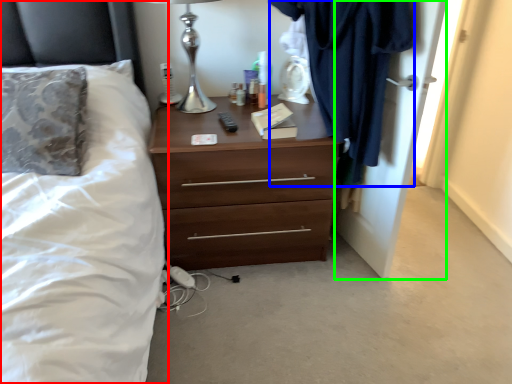
Question: Which object is the closest to the bed (highlighted by a red box)? Choose among these: clothing (highlighted by a blue box) or door (highlighted by a green box).

Choices:
 (A) clothing
 (B) door

Answer: (A)